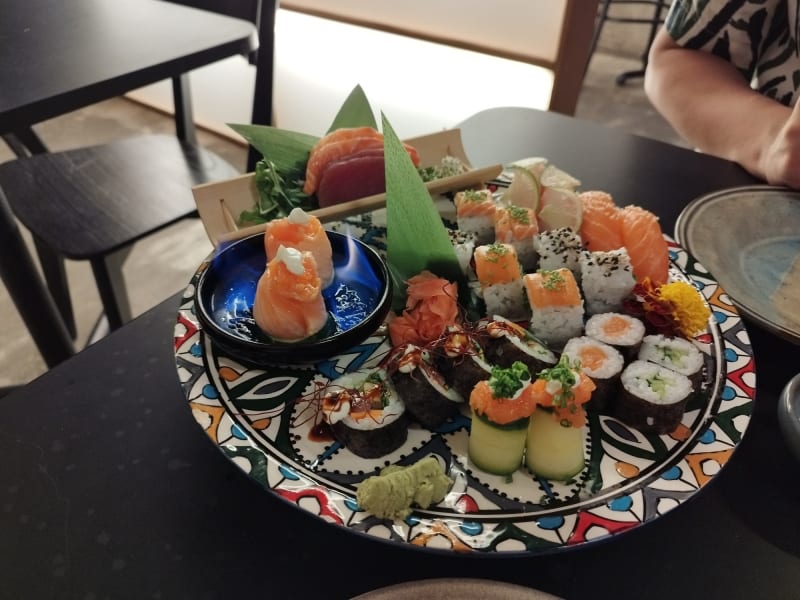
Locate an element on the screen. The width and height of the screenshot is (800, 600). plate is located at coordinates (266, 475).